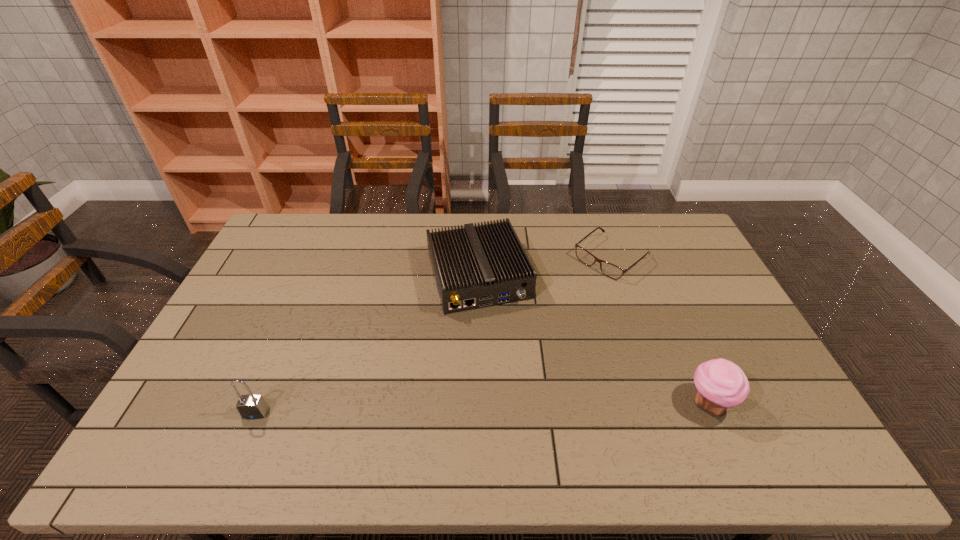
Find the location of a particular element. The image size is (960, 540). padlock is located at coordinates (250, 406).

I want to click on cupcake, so click(x=721, y=384).

Locate an element on the screen. router is located at coordinates (479, 266).

At what (x,y) coordinates should I click in order to perform the action: click on the second shortest object. Please return your answer as a coordinate pair (x, y). Image resolution: width=960 pixels, height=540 pixels. Looking at the image, I should click on (479, 266).

You are a GUI agent. You are given a task and a screenshot of the screen. Output one action in this format:
    pyautogui.click(x=<x>, y=<y>)
    Task: Click on the shortest object
    This screenshot has height=540, width=960.
    Given the screenshot: What is the action you would take?
    (x=610, y=270)

The image size is (960, 540). I want to click on vacant space located 0.110m on the left of the cupcake, so click(x=642, y=403).

You are a GUI agent. You are given a task and a screenshot of the screen. Output one action in this format:
    pyautogui.click(x=<x>, y=<y>)
    Task: Click on the vacant region located 0.290m on the back panel of the router
    
    Given the screenshot: What is the action you would take?
    pyautogui.click(x=521, y=397)

You are a GUI agent. You are given a task and a screenshot of the screen. Output one action in this format:
    pyautogui.click(x=<x>, y=<y>)
    Task: Click on the blank space located on the back panel of the router
    
    Given the screenshot: What is the action you would take?
    pyautogui.click(x=504, y=350)

Where is `vacant area located on the back panel of the router`? This screenshot has width=960, height=540. vacant area located on the back panel of the router is located at coordinates (518, 391).

I want to click on free space located on the lenses of the spectacles, so click(581, 282).